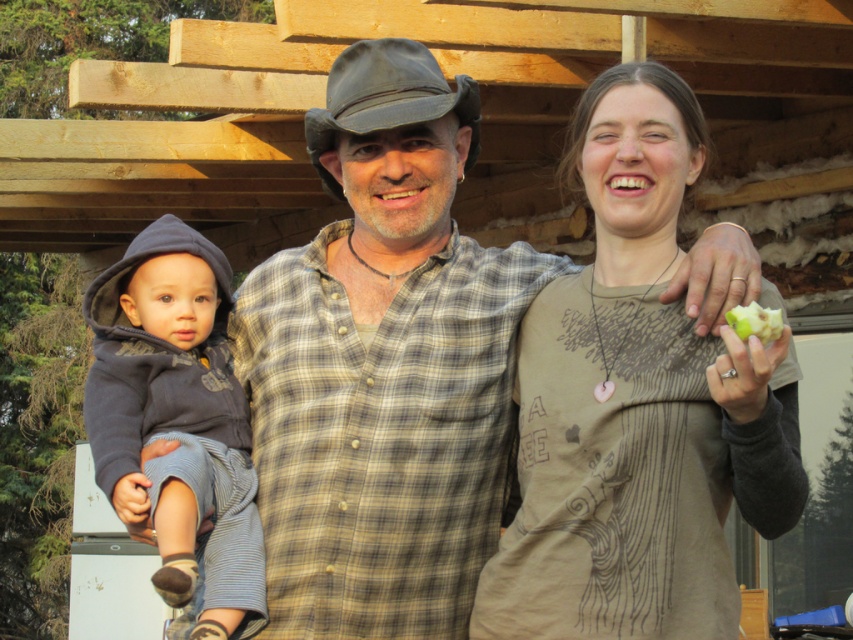
Question: Which of the following is the farthest from the observer?

Choices:
 (A) dark gray fleece hoodie at left
 (B) matte brown sweater at center

Answer: (A)

Question: Can you confirm if matte brown sweater at center is positioned to the right of dark gray fleece hoodie at left?

Choices:
 (A) yes
 (B) no

Answer: (A)

Question: Which of the following is the farthest from the observer?

Choices:
 (A) matte brown sweater at center
 (B) dark gray fleece hoodie at left
 (C) green matte apple at upper right

Answer: (B)

Question: Based on their relative distances, which object is farther from the dark gray fleece hoodie at left?

Choices:
 (A) matte brown sweater at center
 (B) green matte apple at upper right

Answer: (B)

Question: Can you confirm if dark gray fleece hoodie at left is positioned below green matte apple at upper right?

Choices:
 (A) no
 (B) yes

Answer: (B)

Question: Does matte brown sweater at center have a larger size compared to green matte apple at upper right?

Choices:
 (A) no
 (B) yes

Answer: (B)